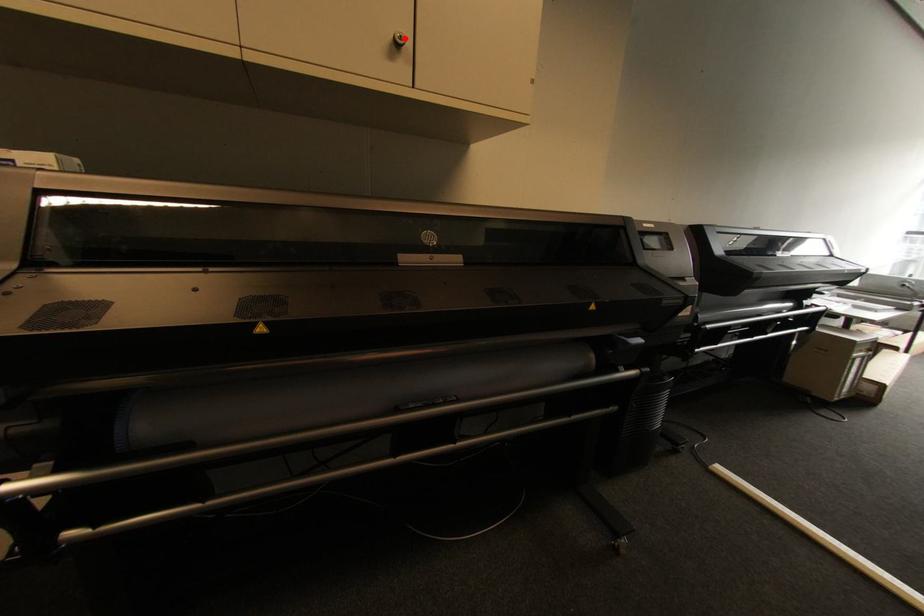
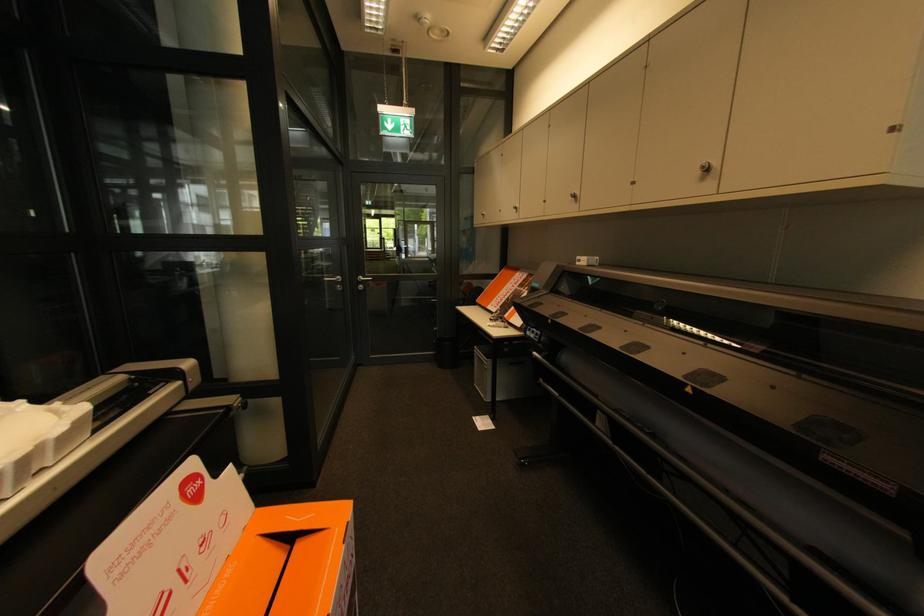
In the second image, find the point that corresponds to the highlighted location in the first image.

(707, 168)